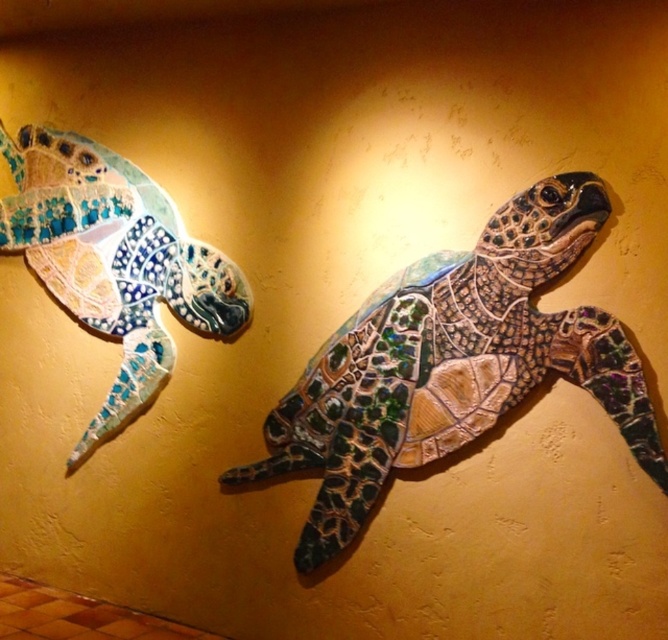
Question: Can you confirm if shiny mosaic turtle at center is positioned below shiny mosaic turtle at left?

Choices:
 (A) yes
 (B) no

Answer: (A)

Question: Is shiny mosaic turtle at center above shiny mosaic turtle at left?

Choices:
 (A) no
 (B) yes

Answer: (A)

Question: Which object appears farthest from the camera in this image?

Choices:
 (A) shiny mosaic turtle at left
 (B) shiny mosaic turtle at center

Answer: (A)

Question: Which object appears closest to the camera in this image?

Choices:
 (A) shiny mosaic turtle at center
 (B) shiny mosaic turtle at left

Answer: (A)

Question: Which point is farther to the camera?

Choices:
 (A) (39, 209)
 (B) (488, 273)

Answer: (A)

Question: Does shiny mosaic turtle at center have a smaller size compared to shiny mosaic turtle at left?

Choices:
 (A) no
 (B) yes

Answer: (A)